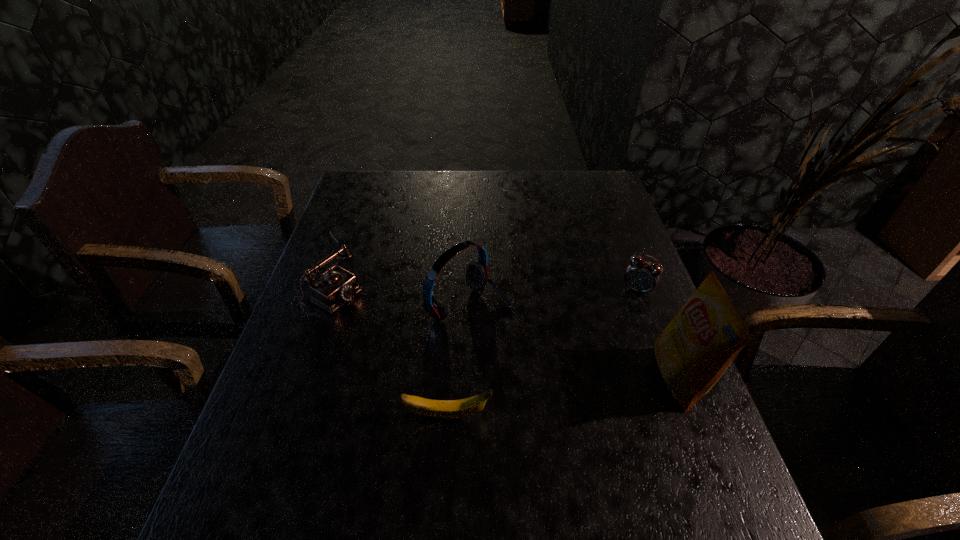
This screenshot has height=540, width=960. What are the coordinates of `free space located with the microphone attached to the side of the headset` in the screenshot? It's located at (558, 357).

I want to click on vacant space situated 0.160m with the microphone attached to the side of the headset, so click(x=555, y=355).

Identify the location of free space located 0.140m on the face of the alarm clock. This screenshot has height=540, width=960. (612, 332).

Find the location of a particular element. Image resolution: width=960 pixels, height=540 pixels. vacant space situated 0.290m on the face of the alarm clock is located at coordinates (586, 376).

Where is `blank space located 0.190m on the face of the alarm clock`? blank space located 0.190m on the face of the alarm clock is located at coordinates (603, 346).

The image size is (960, 540). I want to click on free spot located on the dial of the telephone, so click(445, 355).

Locate an element on the screen. The width and height of the screenshot is (960, 540). vacant area located 0.300m on the dial of the telephone is located at coordinates (445, 355).

In order to click on free point located 0.170m on the dial of the telephone in this screenshot , I will do `click(403, 330)`.

The width and height of the screenshot is (960, 540). Identify the location of object located at the left edge. (338, 286).

At what (x,y) coordinates should I click in order to perform the action: click on crisp (potato chip) present at the right edge. Please return your answer as a coordinate pair (x, y). The height and width of the screenshot is (540, 960). Looking at the image, I should click on coord(695,349).